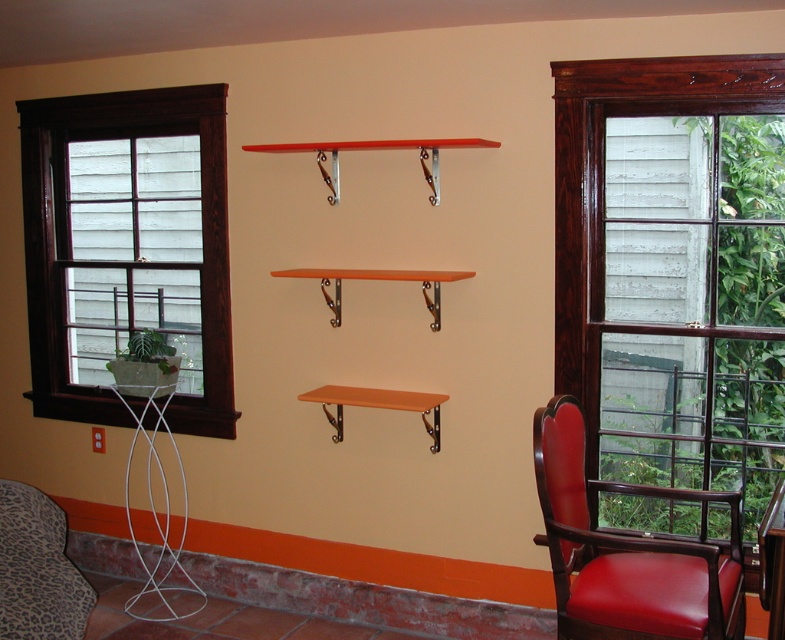
Which of these two, orange matte shelf at center or matte orange shelf at center, stands shorter?

With less height is matte orange shelf at center.

Is point (444, 138) more distant than point (425, 422)?

No, it is not.

Measure the distance between point (422, 164) and camera.

Point (422, 164) and camera are 3.00 meters apart.

The width and height of the screenshot is (785, 640). Identify the location of orange matte shelf at center. (375, 148).

Can you confirm if leather armchair at right is wider than orange wood shelf at center?

No.

Does leather armchair at right appear on the left side of orange wood shelf at center?

Incorrect, leather armchair at right is not on the left side of orange wood shelf at center.

Is point (645, 540) positioned after point (469, 272)?

No.

I want to click on leather armchair at right, so click(628, 552).

Is point (677, 387) in front of point (333, 196)?

That is True.

Does wooden frame window at right have a lesser height compared to orange matte shelf at center?

No.

Which is in front, point (718, 204) or point (468, 141)?

Point (468, 141) is more forward.

Identify the location of wooden frame window at right. The height and width of the screenshot is (640, 785). (692, 305).